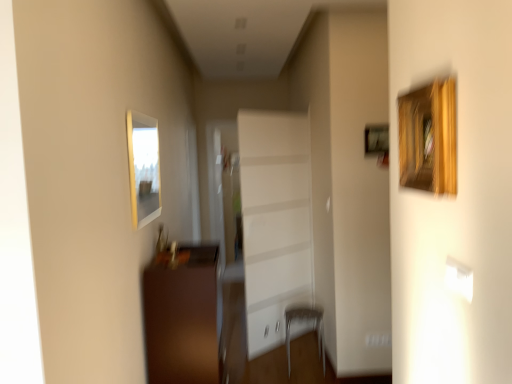
Question: Is metallic silver armchair at lower center surrounded by white glossy cabinet at center?

Choices:
 (A) no
 (B) yes

Answer: (A)

Question: Can you confirm if white glossy cabinet at center is taller than metallic silver armchair at lower center?

Choices:
 (A) no
 (B) yes

Answer: (B)

Question: Is white glossy cabinet at center oriented towards metallic silver armchair at lower center?

Choices:
 (A) yes
 (B) no

Answer: (A)

Question: From a real-world perspective, is white glossy cabinet at center located higher than metallic silver armchair at lower center?

Choices:
 (A) yes
 (B) no

Answer: (A)

Question: From a real-world perspective, is white glossy cabinet at center located beneath metallic silver armchair at lower center?

Choices:
 (A) no
 (B) yes

Answer: (A)

Question: Considering the relative sizes of white glossy cabinet at center and metallic silver armchair at lower center in the image provided, is white glossy cabinet at center shorter than metallic silver armchair at lower center?

Choices:
 (A) no
 (B) yes

Answer: (A)

Question: Can you confirm if matte wooden picture frame at upper left is smaller than white glossy cabinet at center?

Choices:
 (A) no
 (B) yes

Answer: (B)

Question: Considering the relative sizes of matte wooden picture frame at upper left and white glossy cabinet at center in the image provided, is matte wooden picture frame at upper left shorter than white glossy cabinet at center?

Choices:
 (A) yes
 (B) no

Answer: (A)

Question: Does matte wooden picture frame at upper left have a greater height compared to white glossy cabinet at center?

Choices:
 (A) no
 (B) yes

Answer: (A)

Question: Are matte wooden picture frame at upper left and white glossy cabinet at center beside each other?

Choices:
 (A) no
 (B) yes

Answer: (A)

Question: Could you tell me if matte wooden picture frame at upper left is turned towards white glossy cabinet at center?

Choices:
 (A) no
 (B) yes

Answer: (A)

Question: Does matte wooden picture frame at upper left have a lesser width compared to white glossy cabinet at center?

Choices:
 (A) yes
 (B) no

Answer: (B)

Question: Is brown wooden cabinet at lower left at the right side of metallic silver armchair at lower center?

Choices:
 (A) yes
 (B) no

Answer: (B)